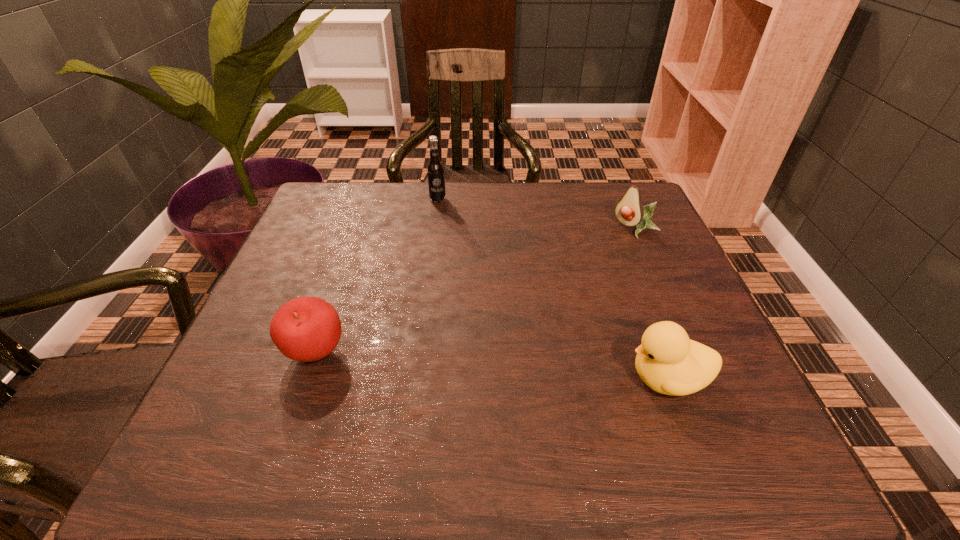
Locate an element on the screen. Image resolution: width=960 pixels, height=540 pixels. the leftmost object is located at coordinates (306, 329).

This screenshot has width=960, height=540. Identify the location of duck. (667, 361).

Identify the location of the tallest object. [x=435, y=170].

Find the location of a particular element. The width and height of the screenshot is (960, 540). root beer is located at coordinates (435, 170).

Where is `avocado`? The image size is (960, 540). avocado is located at coordinates [x=629, y=211].

Identify the location of vacant region located 0.140m on the back of the leftmost object. The width and height of the screenshot is (960, 540). (340, 283).

The width and height of the screenshot is (960, 540). Identify the location of vacant point located on the front-facing side of the duck. (448, 379).

The height and width of the screenshot is (540, 960). Identify the location of vacant space located on the front-facing side of the duck. (570, 379).

I want to click on free point located 0.230m on the front-facing side of the duck, so click(x=498, y=379).

Locate an element on the screen. The width and height of the screenshot is (960, 540). vacant space located on the label of the root beer is located at coordinates (458, 249).